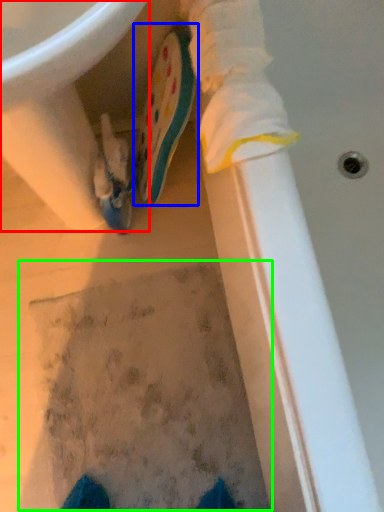
Question: Which is nearer to the sink (highlighted by a red box)? footwear (highlighted by a blue box) or footprint (highlighted by a green box).

Choices:
 (A) footwear
 (B) footprint

Answer: (A)